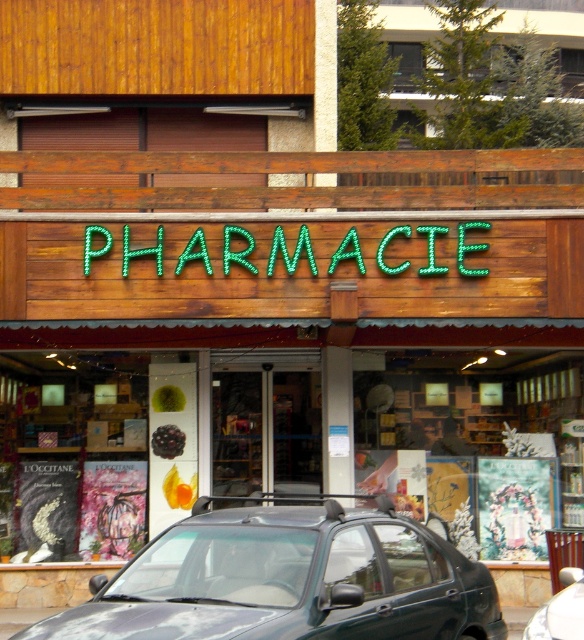
You are a customer entering the pharmacy and need to reach the metallic gray car at center. Is the wooden display case at center blocking your path? Please explain.

The wooden display case at center has a larger size compared to the metallic gray car at center. Since the display case is larger, it is likely blocking the path to the metallic gray car at center.

What is located at the point with coordinates (288, 580) in the image?

A dark green matte car at center is located at the point with coordinates (288, 580).

Looking at this image, you are a customer standing outside the pharmacy. You see the wooden display case at center and the metallic gray car at center. Which object is positioned higher from the ground?

The wooden display case at center is above the metallic gray car at center, so it is positioned higher from the ground.